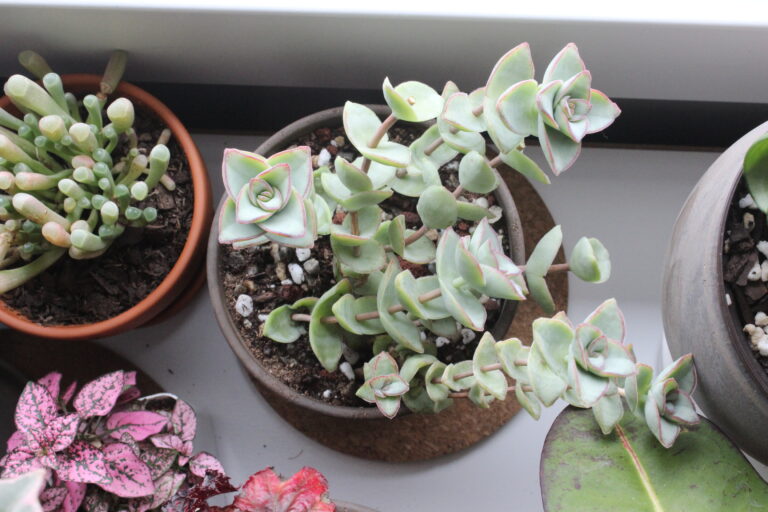
The height and width of the screenshot is (512, 768). Find the location of `pot base`. pot base is located at coordinates (445, 433).